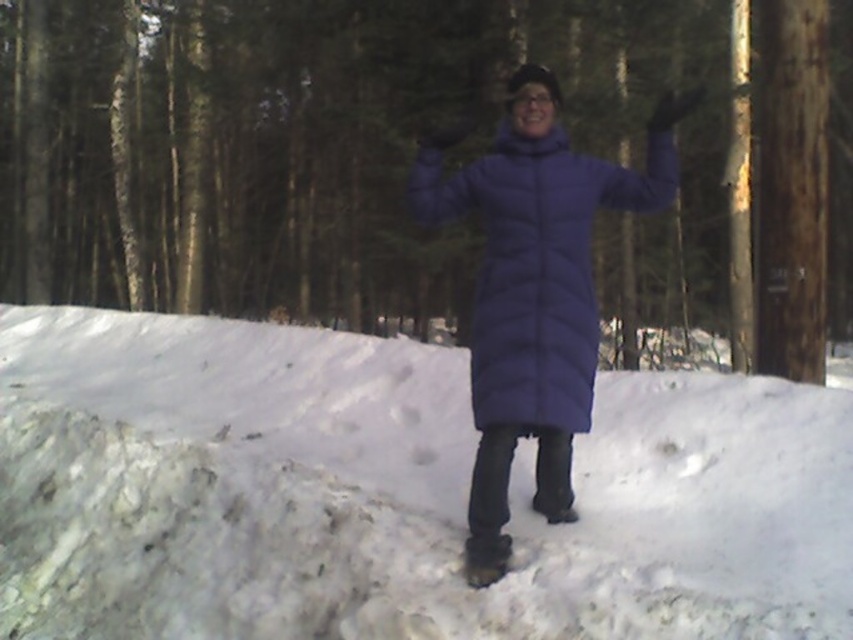
Question: Is brown wood pole at center right thinner than white fluffy snow at center?

Choices:
 (A) no
 (B) yes

Answer: (A)

Question: Observing the image, what is the correct spatial positioning of white fluffy snow at center in reference to matte blue puffer jacket at center?

Choices:
 (A) below
 (B) above

Answer: (A)

Question: Which object is the farthest from the brown wood pole at center right?

Choices:
 (A) matte blue puffer jacket at center
 (B) white fluffy snow at center

Answer: (A)

Question: Which object is farther from the camera taking this photo?

Choices:
 (A) matte blue puffer jacket at center
 (B) white fluffy snow at center

Answer: (B)

Question: Which of these objects is positioned farthest from the matte blue puffer jacket at center?

Choices:
 (A) brown wood pole at center right
 (B) white fluffy snow at center

Answer: (A)

Question: In this image, where is white fluffy snow at center located relative to matte blue puffer jacket at center?

Choices:
 (A) above
 (B) below

Answer: (B)